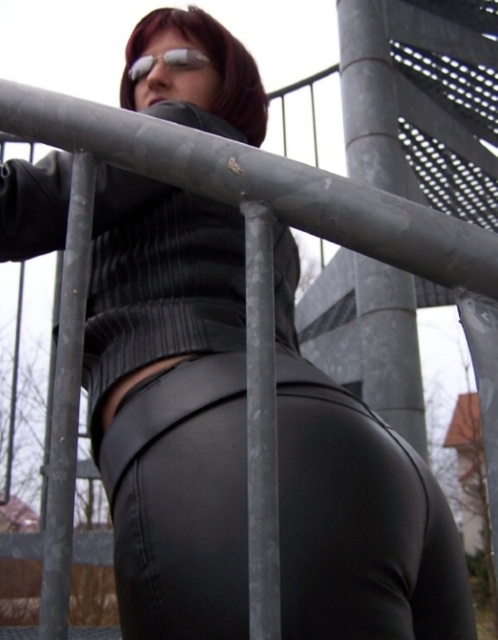
Who is lower down, black leather leggings at center or shiny silver goggles at upper center?

Positioned lower is black leather leggings at center.

Who is more distant from viewer, (102, 476) or (178, 67)?

The point (178, 67) is more distant.

Between point (297, 557) and point (140, 70), which one is positioned in front?

Point (297, 557) is more forward.

You are a GUI agent. You are given a task and a screenshot of the screen. Output one action in this format:
    pyautogui.click(x=<x>, y=<y>)
    Task: Click on the black leather leggings at center
    This screenshot has width=498, height=640.
    Given the screenshot: What is the action you would take?
    pyautogui.click(x=360, y=522)

Is point (75, 433) positioned after point (163, 54)?

No, it is in front of (163, 54).

Can you confirm if metallic gray pole at center is bigger than shiny silver goggles at upper center?

Yes, metallic gray pole at center is bigger than shiny silver goggles at upper center.

Between point (81, 269) and point (134, 72), which one is positioned in front?

Positioned in front is point (81, 269).

The width and height of the screenshot is (498, 640). I want to click on metallic gray pole at center, so click(x=66, y=404).

Does black leather leggings at center appear on the right side of metallic gray pole at center?

Yes, black leather leggings at center is to the right of metallic gray pole at center.

Does point (206, 560) lie in front of point (81, 304)?

No.

Which is in front, point (378, 452) or point (49, 566)?

Point (49, 566)

Identify the location of black leather leggings at center. (360, 522).